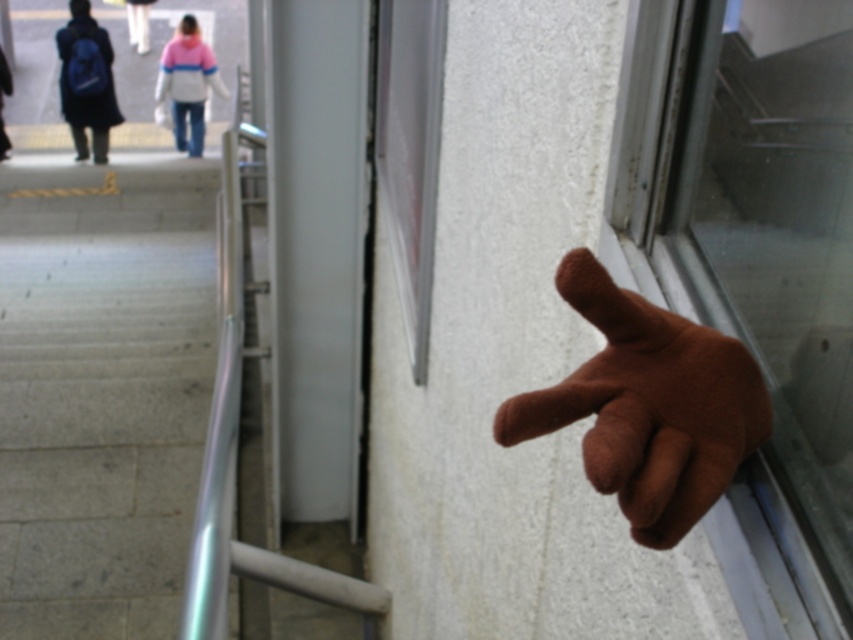
Question: Does transparent glass window at right have a lesser width compared to matte blue backpack at left?

Choices:
 (A) yes
 (B) no

Answer: (A)

Question: Is brown fuzzy hand at center below matte blue backpack at left?

Choices:
 (A) yes
 (B) no

Answer: (A)

Question: Can you confirm if transparent glass window at right is wider than pink fleece sweater at upper center?

Choices:
 (A) yes
 (B) no

Answer: (B)

Question: Which object is positioned closest to the matte blue backpack at left?

Choices:
 (A) pink fleece sweater at upper center
 (B) brown fuzzy hand at center

Answer: (A)

Question: Which is farther from the pink fleece jacket at upper center?

Choices:
 (A) gray concrete stairs at lower left
 (B) matte blue backpack at left

Answer: (A)

Question: Which of the following is the farthest from the observer?

Choices:
 (A) brown fuzzy hand at center
 (B) pink fleece sweater at upper center
 (C) matte black backpack at upper left
 (D) pink fleece jacket at upper center

Answer: (D)